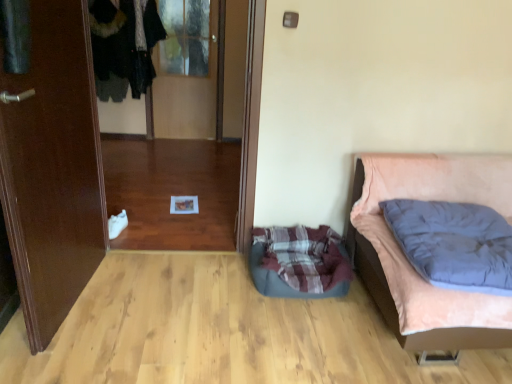
This screenshot has height=384, width=512. Find the location of `vacant area in front of brown wooden door at left`. vacant area in front of brown wooden door at left is located at coordinates (70, 349).